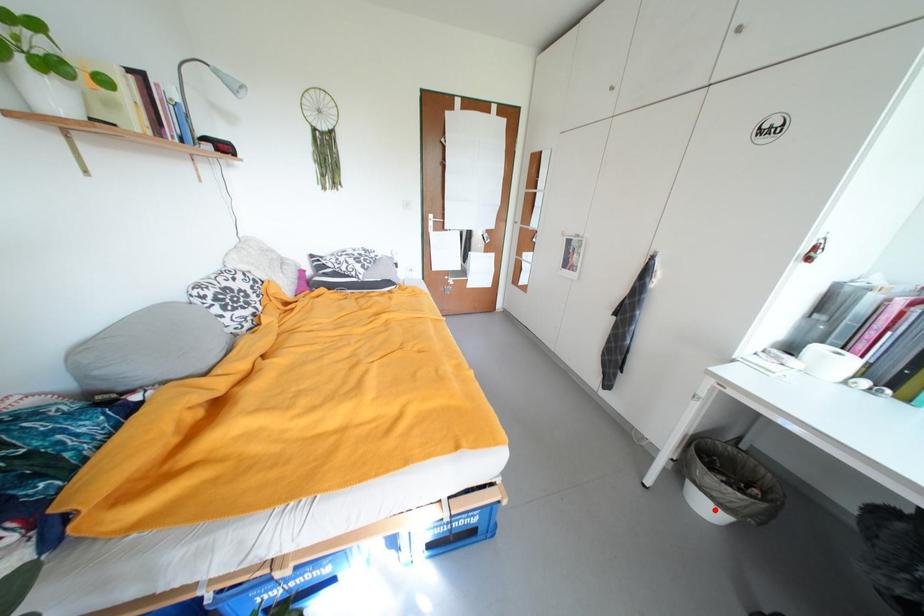
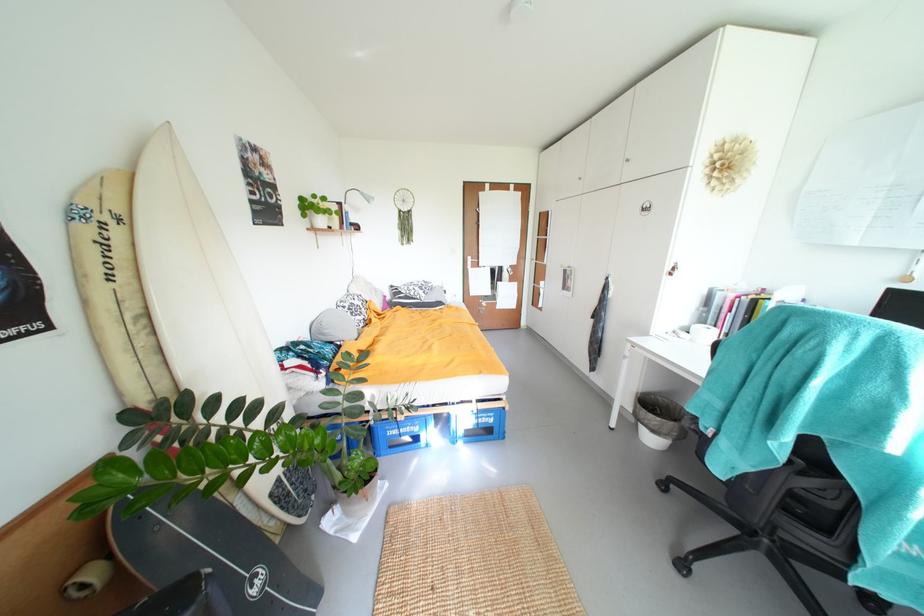
Question: I am providing you with two images of the same scene from different viewpoints. In image1, a red point is highlighted. Considering the same 3D point in image2, which of the following is correct?

Choices:
 (A) It is closer
 (B) It is farther

Answer: (A)